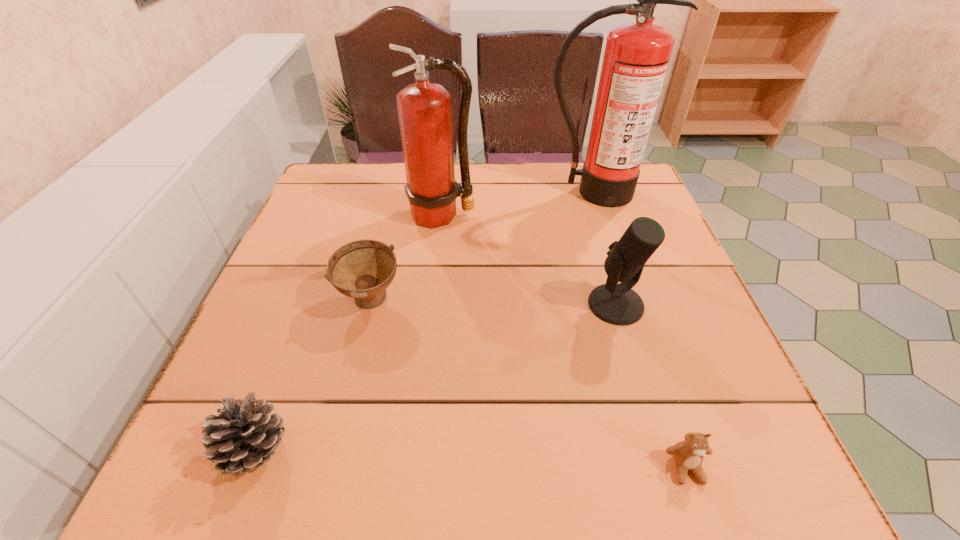
Locate an element on the screen. Image resolution: width=960 pixels, height=540 pixels. object positioned at the near left corner is located at coordinates (243, 436).

Find the location of a particular element. This screenshot has height=540, width=960. object that is positioned at the far right corner is located at coordinates (636, 57).

Identify the location of object located at the near right corner. The width and height of the screenshot is (960, 540). (688, 455).

Where is `vacant point at the far edge`? vacant point at the far edge is located at coordinates (559, 178).

Locate an element on the screen. This screenshot has width=960, height=540. vacant space at the near edge of the desktop is located at coordinates (410, 445).

In the image, there is a desktop. Where is `vacant area at the left edge`? Image resolution: width=960 pixels, height=540 pixels. vacant area at the left edge is located at coordinates (323, 242).

In order to click on free space at the right edge of the desktop in this screenshot , I will do `click(684, 300)`.

At what (x,y) coordinates should I click in order to perform the action: click on vacant space at the near right corner. Please return your answer as a coordinate pair (x, y). This screenshot has height=540, width=960. Looking at the image, I should click on (699, 484).

Identify the location of vacant space that is in between the shortest object and the pinecone. The height and width of the screenshot is (540, 960). (470, 459).

Find the location of a particular element. This screenshot has width=960, height=540. vacant area that lies between the soup bowl and the left fire extinguisher is located at coordinates (406, 259).